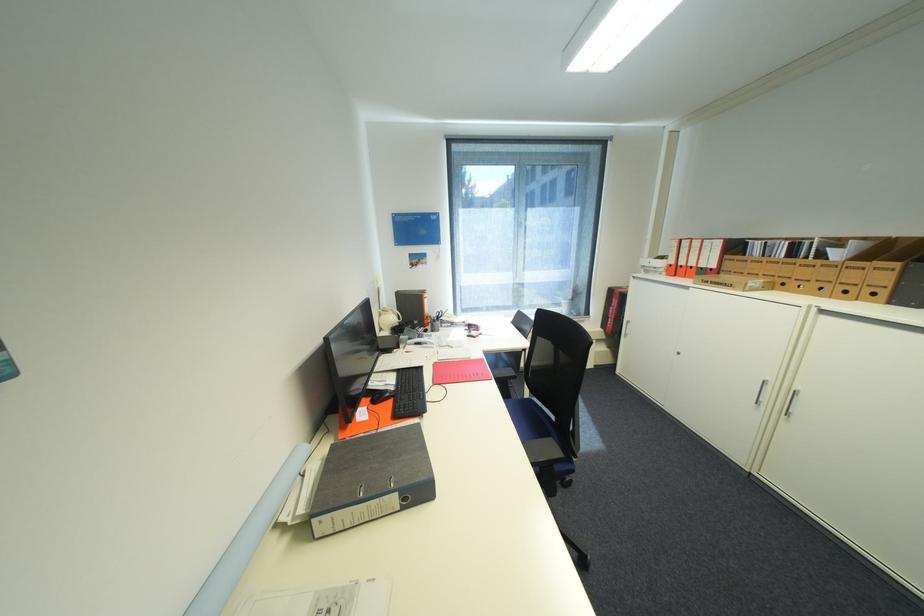
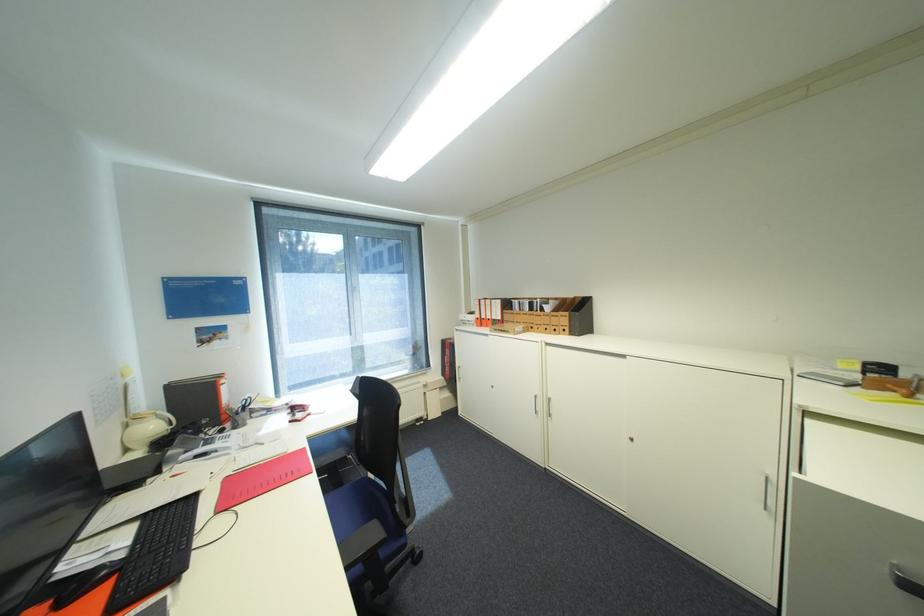
Find the pixel in the second image that matches point 669,265 in the first image.

(480, 318)